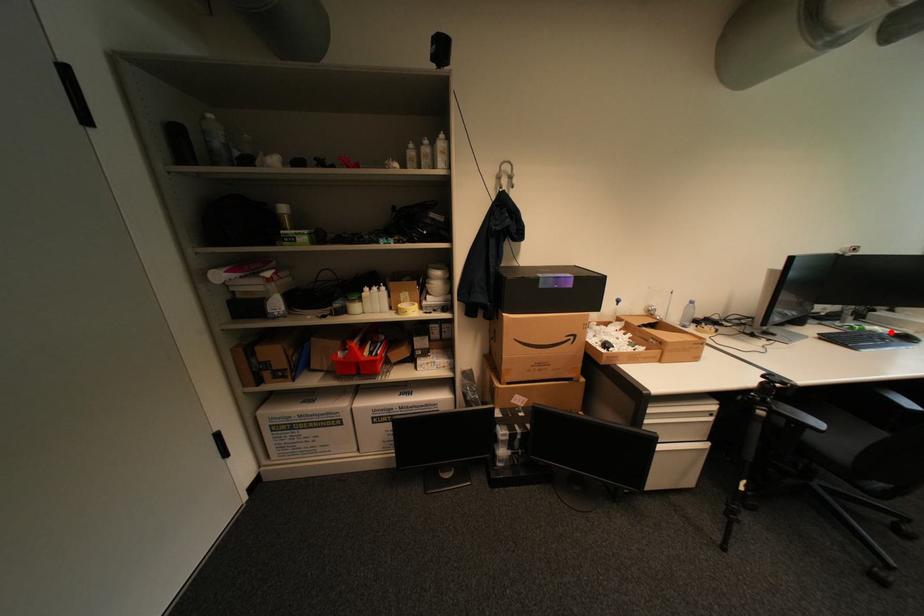
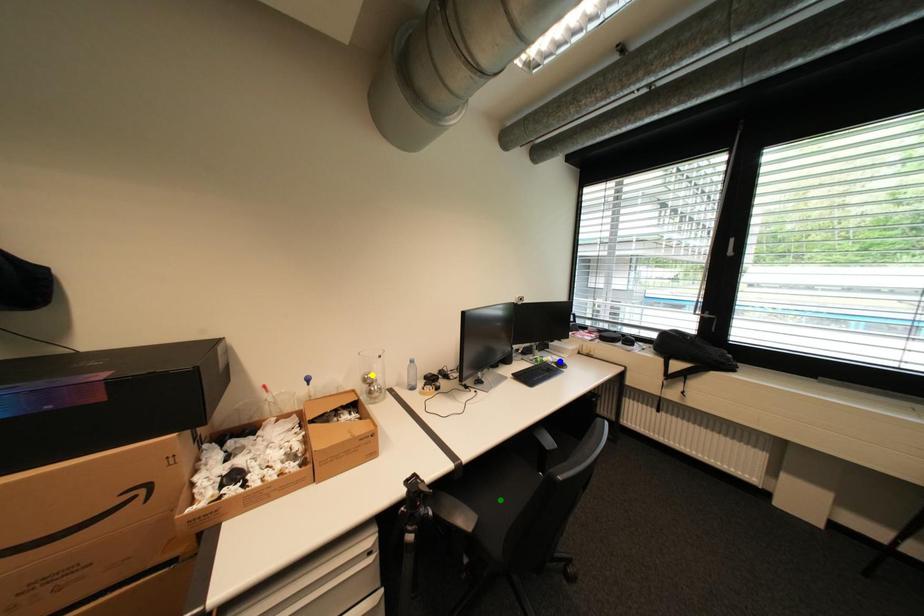
Question: I am providing you with two images of the same scene from different viewpoints. A red point is marked on the first image. You are given multiple points on the second image. In image 2, which mark is for the same physical point as the one in image 1?

Choices:
 (A) green point
 (B) blue point
 (C) yellow point

Answer: (B)